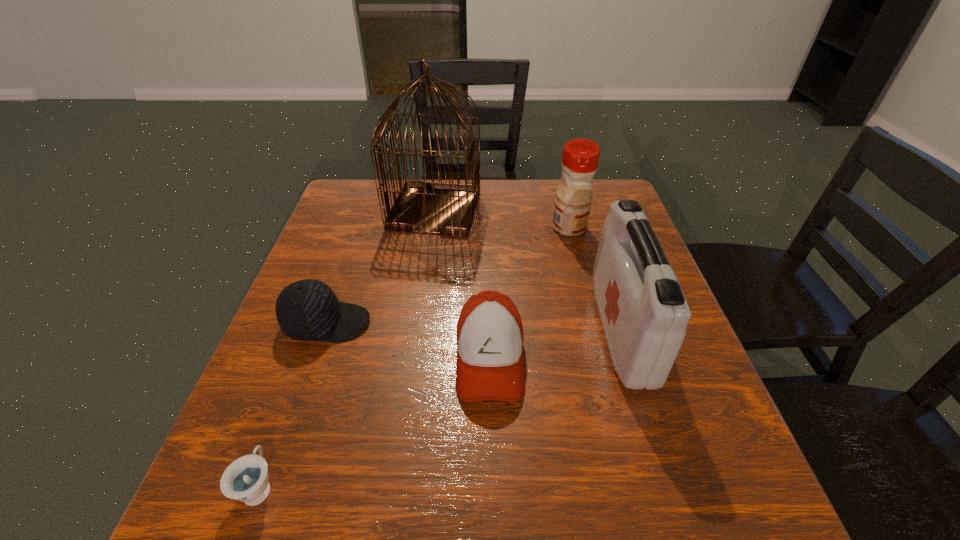
I want to click on object located at the near edge, so click(x=246, y=479).

Find the location of a particular element. The image size is (960, 540). baseball cap present at the left edge is located at coordinates (307, 310).

Identify the location of teacup that is at the left edge. (246, 479).

Where is `condiment that is at the right edge`? The height and width of the screenshot is (540, 960). condiment that is at the right edge is located at coordinates (580, 157).

This screenshot has width=960, height=540. What are the coordinates of `the first-aid kit located in the right edge section of the desktop` in the screenshot? It's located at (644, 314).

Find the location of a particular element. The width and height of the screenshot is (960, 540). object located in the near left corner section of the desktop is located at coordinates (246, 479).

Locate an element on the screen. object present at the far right corner is located at coordinates (580, 157).

Where is `free space at the far edge`? free space at the far edge is located at coordinates (498, 221).

In order to click on free location at the left edge of the desktop in this screenshot , I will do `click(368, 252)`.

In the image, there is a desktop. What are the coordinates of `vacant area at the far left corner` in the screenshot? It's located at (354, 200).